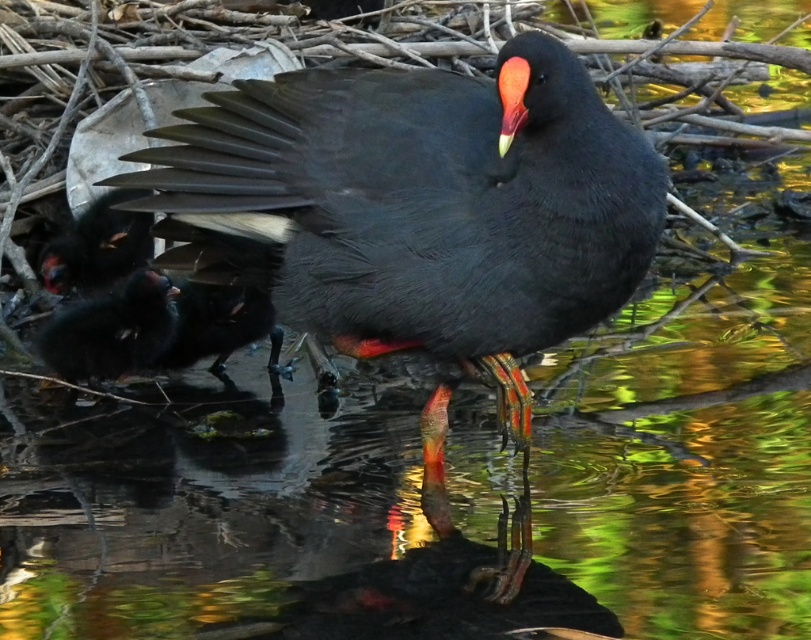
You are a wildlife photographer trying to capture a clear shot of both the matte black bird at center and the matte black bird at lower left. Given that your camera can only focus on objects within a 1.5 meter width, will both birds fit within the frame if you position the camera to include both?

The matte black bird at center is wider than the matte black bird at lower left. Since the camera can focus on objects within a 1.5 meter width, both birds can fit as long as their combined width does not exceed 1.5 meters. However, the exact answer depends on their individual widths, which are not provided.

You are a wildlife photographer trying to capture a clear photo of the matte black bird at center and the matte black bird at lower left. Which bird is closer to the camera?

The matte black bird at center is positioned over the matte black bird at lower left, so it is closer to the camera.